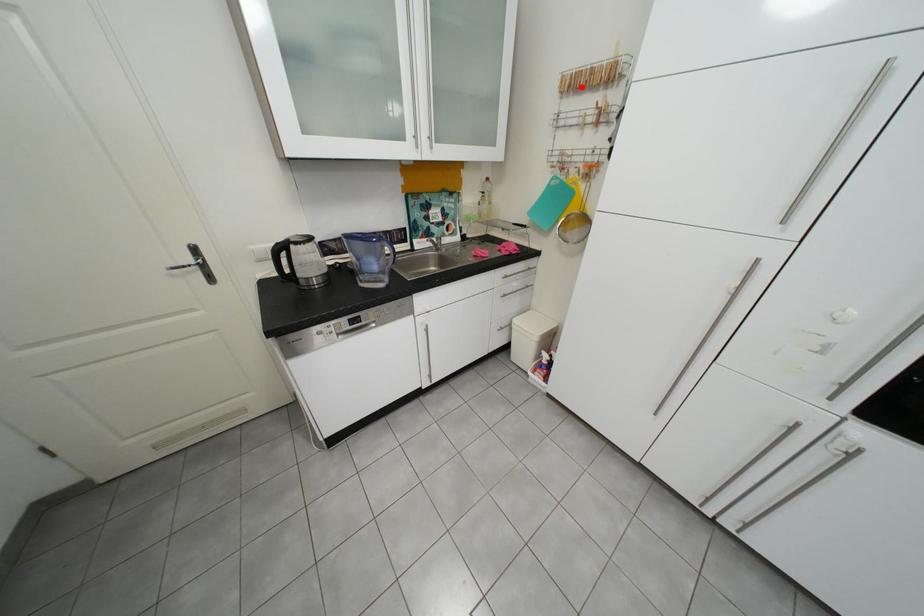
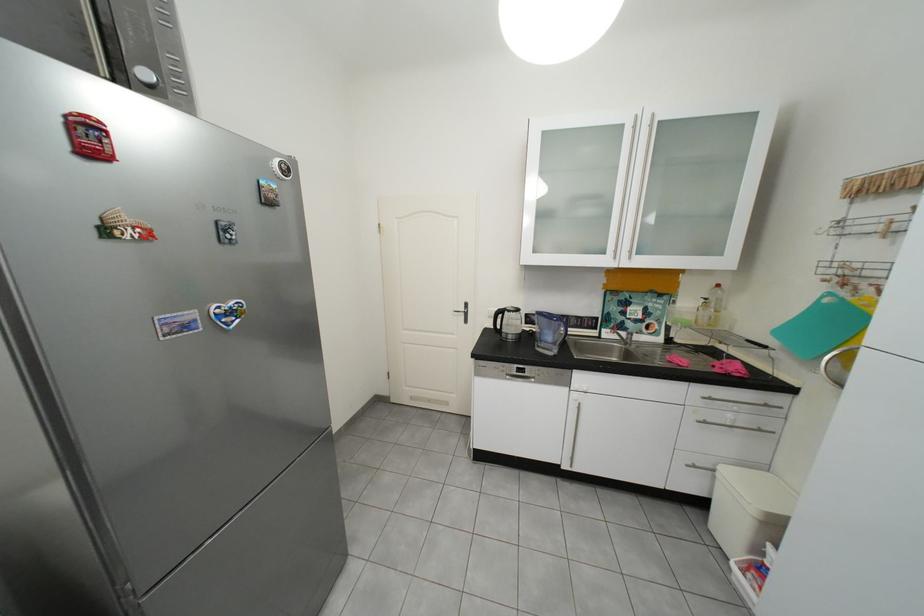
In the second image, find the point that corresponds to the highlighted location in the first image.

(870, 192)